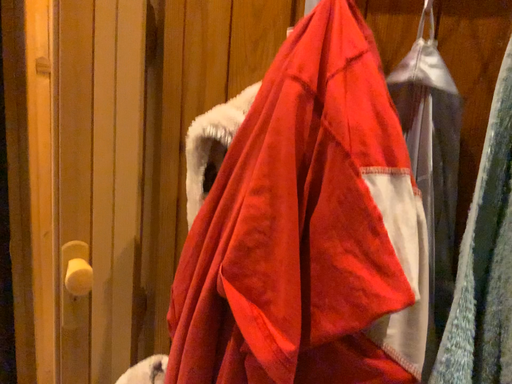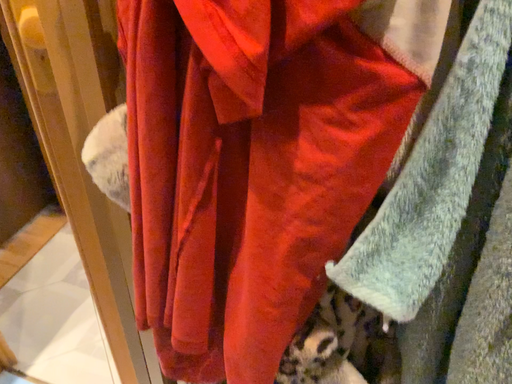
Question: Which way did the camera rotate in the video?

Choices:
 (A) rotated downward
 (B) rotated upward

Answer: (A)